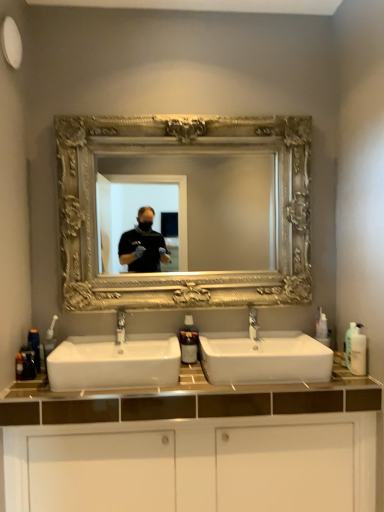
The image size is (384, 512). I want to click on vacant space in front of silver metallic tap at center, which is the first tap in right-to-left order, so click(x=258, y=351).